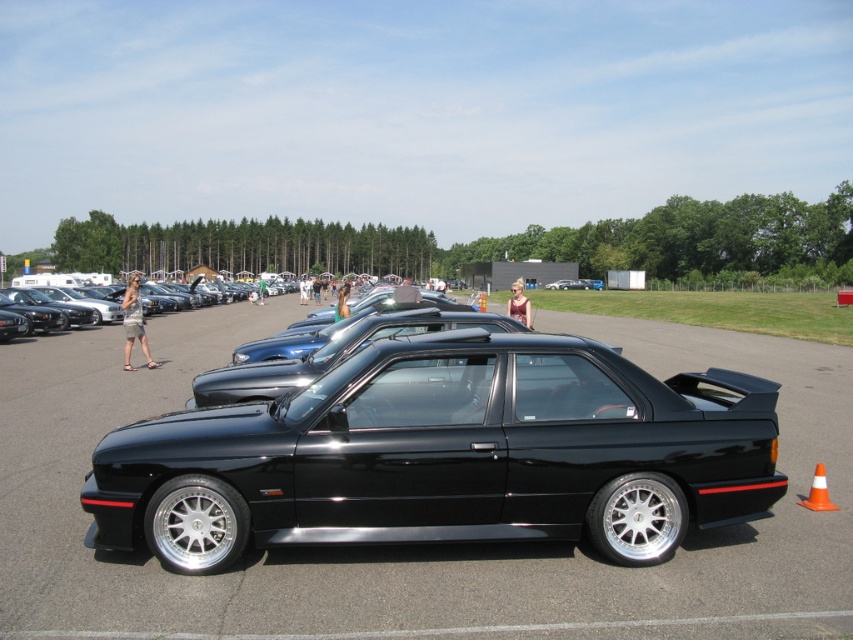
Is shiny black car at center further to the viewer compared to black matte car at center?

That is False.

What do you see at coordinates (445, 456) in the screenshot?
I see `shiny black car at center` at bounding box center [445, 456].

Find the location of a particular element. shiny black car at center is located at coordinates (445, 456).

Can you confirm if blue denim shorts at center is wider than green fabric shirt at center?

No, blue denim shorts at center is not wider than green fabric shirt at center.

Which is behind, point (347, 308) or point (264, 285)?

Positioned behind is point (264, 285).

The height and width of the screenshot is (640, 853). In order to click on blue denim shorts at center in this screenshot , I will do `click(341, 301)`.

Can you confirm if blonde hair at center is smaller than black matte car at center?

Incorrect, blonde hair at center is not smaller in size than black matte car at center.

Can you confirm if blonde hair at center is shorter than black matte car at center?

Incorrect, blonde hair at center's height does not fall short of black matte car at center's.

Where is `blonde hair at center`? Image resolution: width=853 pixels, height=640 pixels. blonde hair at center is located at coordinates (519, 305).